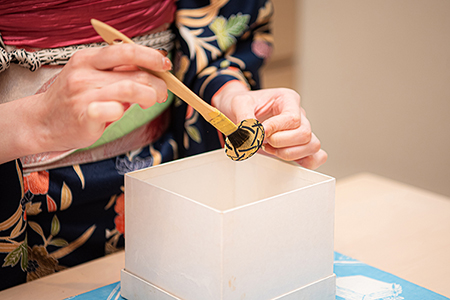
Where is `table`? This screenshot has height=300, width=450. table is located at coordinates (381, 242).